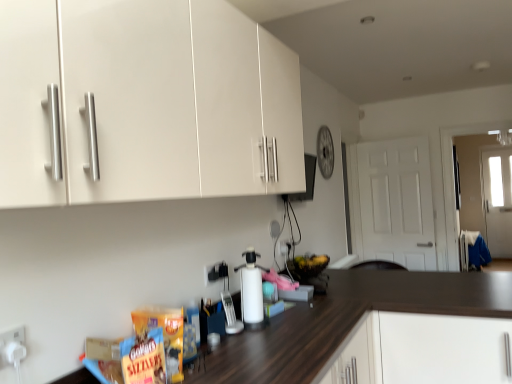
Question: Does white matte door at right have a lesser height compared to white matte cabinet at lower right?

Choices:
 (A) yes
 (B) no

Answer: (B)

Question: Does white matte door at right have a lesser width compared to white matte cabinet at lower right?

Choices:
 (A) no
 (B) yes

Answer: (B)

Question: Does white matte door at right have a smaller size compared to white matte cabinet at lower right?

Choices:
 (A) no
 (B) yes

Answer: (B)

Question: Is white matte cabinet at lower right a part of white matte door at right?

Choices:
 (A) yes
 (B) no

Answer: (B)

Question: Does white matte door at right have a larger size compared to white matte cabinet at lower right?

Choices:
 (A) no
 (B) yes

Answer: (A)

Question: Do you think white plastic electric outlet at lower left, placed as the 3th electric outlet when sorted from right to left, is within white plastic electric outlet at center, arranged as the 1th electric outlet when viewed from the back, or outside of it?

Choices:
 (A) outside
 (B) inside

Answer: (A)

Question: Is white plastic electric outlet at lower left, positioned as the first electric outlet in front-to-back order, bigger or smaller than white plastic electric outlet at center, which appears as the third electric outlet when viewed from the left?

Choices:
 (A) small
 (B) big

Answer: (B)

Question: Is point pos(8,329) closer or farther from the camera than point pos(280,251)?

Choices:
 (A) closer
 (B) farther

Answer: (A)

Question: In terms of height, does white plastic electric outlet at lower left, positioned as the third electric outlet in back-to-front order, look taller or shorter compared to white plastic electric outlet at center, which appears as the third electric outlet when viewed from the left?

Choices:
 (A) short
 (B) tall

Answer: (B)

Question: Does point (9, 342) appear closer or farther from the camera than point (251, 296)?

Choices:
 (A) farther
 (B) closer

Answer: (B)

Question: From the image's perspective, is white plastic electric outlet at lower left, placed as the 3th electric outlet when sorted from right to left, positioned above or below white matte bottle at center?

Choices:
 (A) above
 (B) below

Answer: (A)

Question: Is white plastic electric outlet at lower left, positioned as the first electric outlet in left-to-right order, situated inside white matte bottle at center or outside?

Choices:
 (A) outside
 (B) inside

Answer: (A)

Question: From a real-world perspective, is white plastic electric outlet at lower left, positioned as the first electric outlet in left-to-right order, positioned above or below white matte bottle at center?

Choices:
 (A) below
 (B) above

Answer: (B)

Question: In terms of width, does white plastic electric outlet at center, arranged as the 1th electric outlet when viewed from the back, look wider or thinner when compared to white matte bottle at center?

Choices:
 (A) thin
 (B) wide

Answer: (A)

Question: Is white plastic electric outlet at center, which appears as the third electric outlet when viewed from the left, in front of or behind white matte bottle at center in the image?

Choices:
 (A) front
 (B) behind

Answer: (B)